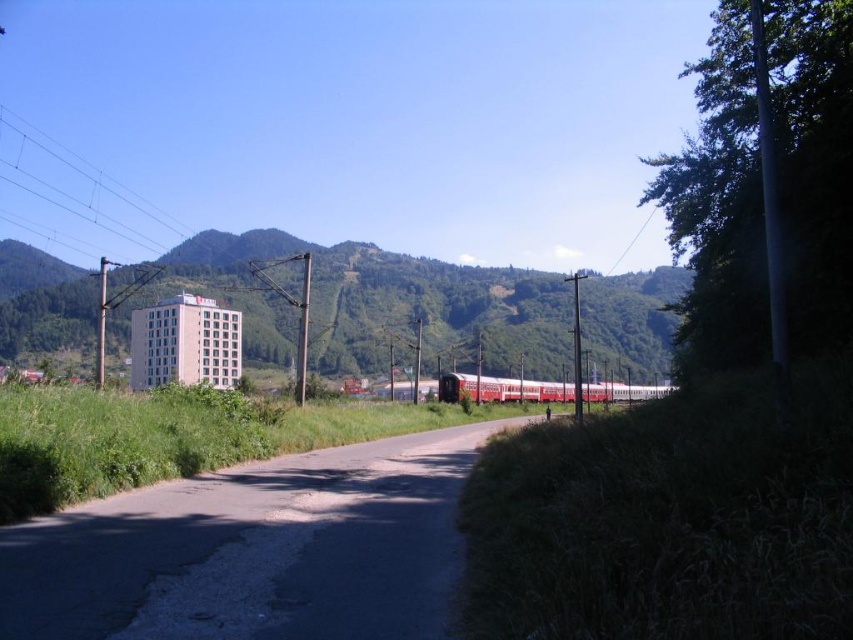
Between point (254, 330) and point (456, 387), which one is positioned behind?

The point (254, 330) is more distant.

What are the coordinates of `green grassy hill at center` in the screenshot? It's located at (370, 304).

Consider the image. Is green grassy hill at center further to camera compared to metallic wire at upper left?

No, green grassy hill at center is in front of metallic wire at upper left.

Between green grassy hill at center and metallic wire at upper left, which one has more height?

metallic wire at upper left

The width and height of the screenshot is (853, 640). What are the coordinates of `green grassy hill at center` in the screenshot? It's located at (370, 304).

Where is `green grassy hill at center`? green grassy hill at center is located at coordinates (370, 304).

Who is positioned more to the right, metallic wire at upper left or red polished metal train at center?

Positioned to the right is red polished metal train at center.

Does point (172, 221) come behind point (529, 385)?

That is True.

Locate an element on the screen. metallic wire at upper left is located at coordinates (76, 186).